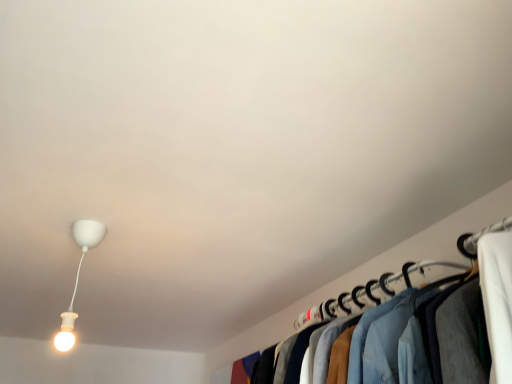
Question: Considering the relative sizes of white matte lamp at upper left and denim jacket at right in the image provided, is white matte lamp at upper left wider than denim jacket at right?

Choices:
 (A) no
 (B) yes

Answer: (A)

Question: Does white matte lamp at upper left lie in front of denim jacket at right?

Choices:
 (A) yes
 (B) no

Answer: (B)

Question: Is white matte lamp at upper left placed right next to denim jacket at right?

Choices:
 (A) no
 (B) yes

Answer: (A)

Question: From a real-world perspective, is white matte lamp at upper left beneath denim jacket at right?

Choices:
 (A) yes
 (B) no

Answer: (B)

Question: Is white matte lamp at upper left taller than denim jacket at right?

Choices:
 (A) no
 (B) yes

Answer: (B)

Question: From a real-world perspective, does white matte lamp at upper left stand above denim jacket at right?

Choices:
 (A) yes
 (B) no

Answer: (A)

Question: Considering the relative positions of denim jacket at right and white matte lamp at upper left in the image provided, is denim jacket at right to the right of white matte lamp at upper left from the viewer's perspective?

Choices:
 (A) yes
 (B) no

Answer: (A)

Question: From a real-world perspective, is denim jacket at right physically below white matte lamp at upper left?

Choices:
 (A) yes
 (B) no

Answer: (A)

Question: Considering the relative sizes of denim jacket at right and white matte lamp at upper left in the image provided, is denim jacket at right wider than white matte lamp at upper left?

Choices:
 (A) yes
 (B) no

Answer: (A)

Question: Is denim jacket at right touching white matte lamp at upper left?

Choices:
 (A) yes
 (B) no

Answer: (B)

Question: Is the depth of denim jacket at right less than that of white matte lamp at upper left?

Choices:
 (A) yes
 (B) no

Answer: (A)

Question: Considering the relative sizes of denim jacket at right and white matte lamp at upper left in the image provided, is denim jacket at right shorter than white matte lamp at upper left?

Choices:
 (A) no
 (B) yes

Answer: (B)

Question: From the image's perspective, relative to white matte lamp at upper left, is denim jacket at right above or below?

Choices:
 (A) above
 (B) below

Answer: (B)